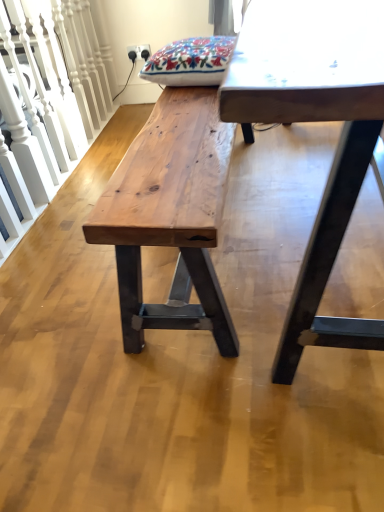
Question: From a real-world perspective, is natural wood bench at center positioned under natural wood bench at left based on gravity?

Choices:
 (A) yes
 (B) no

Answer: (A)

Question: Does natural wood bench at center have a greater height compared to natural wood bench at left?

Choices:
 (A) yes
 (B) no

Answer: (B)

Question: Can you confirm if natural wood bench at center is positioned to the left of natural wood bench at left?

Choices:
 (A) no
 (B) yes

Answer: (A)

Question: Is natural wood bench at left located within natural wood bench at center?

Choices:
 (A) yes
 (B) no

Answer: (B)

Question: Does natural wood bench at center have a lesser height compared to natural wood bench at left?

Choices:
 (A) no
 (B) yes

Answer: (B)

Question: Is natural wood bench at center positioned in front of natural wood bench at left?

Choices:
 (A) yes
 (B) no

Answer: (A)

Question: From the image's perspective, would you say natural wood bench at center is positioned over smooth white table at center?

Choices:
 (A) no
 (B) yes

Answer: (A)

Question: Is natural wood bench at center thinner than smooth white table at center?

Choices:
 (A) no
 (B) yes

Answer: (B)

Question: Is natural wood bench at center taller than smooth white table at center?

Choices:
 (A) no
 (B) yes

Answer: (A)

Question: Is natural wood bench at center next to smooth white table at center and touching it?

Choices:
 (A) no
 (B) yes

Answer: (A)

Question: From a real-world perspective, is natural wood bench at center on smooth white table at center?

Choices:
 (A) no
 (B) yes

Answer: (A)

Question: Is natural wood bench at center located outside smooth white table at center?

Choices:
 (A) yes
 (B) no

Answer: (A)

Question: Considering the relative sizes of natural wood bench at left and natural wood bench at center in the image provided, is natural wood bench at left bigger than natural wood bench at center?

Choices:
 (A) no
 (B) yes

Answer: (A)